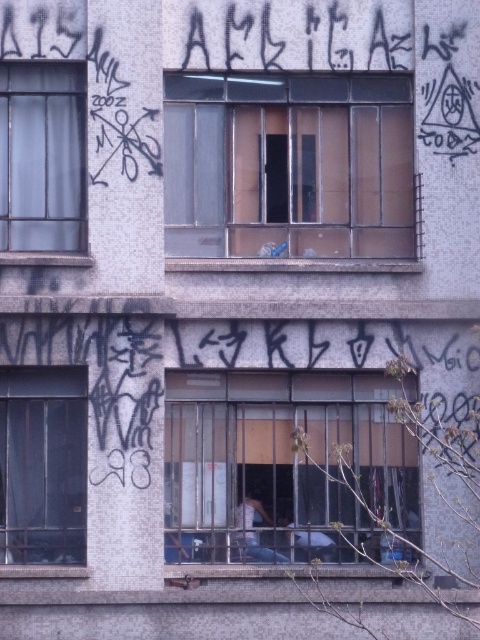
You are an architect analyzing the building facade. You need to determine if the clear glass window at upper center can be replaced with a taller window without removing the metallic bars at center. Based on their current sizes, what do you conclude?

The clear glass window at upper center is not as tall as the metallic bars at center, so it cannot be replaced with a taller window without removing the metallic bars at center.

You are an architect evaluating the building facade. You need to determine if the clear glass window at upper center can be replaced with a standard security window that is 10 cm thick. Based on the current thickness of the metallic bars at center, will this replacement be feasible?

The clear glass window at upper center is thinner than the metallic bars at center. Since the proposed security window is 10 cm thick, if the current metallic bars are thicker than 10 cm, the replacement would be feasible. However, without knowing the exact thickness of the metallic bars, we cannot confirm. But according to the description, the window is thinner than the bars, so if the bars are at least 10 cm, the window can be replaced.

You are an architect assessing the building facade. You need to determine which clear glass window at upper center or clear glass window at upper left has a greater area to decide where to install a larger security camera. Which window should you choose?

The clear glass window at upper center is larger in size than the clear glass window at upper left, so you should choose the clear glass window at upper center to install the larger security camera.